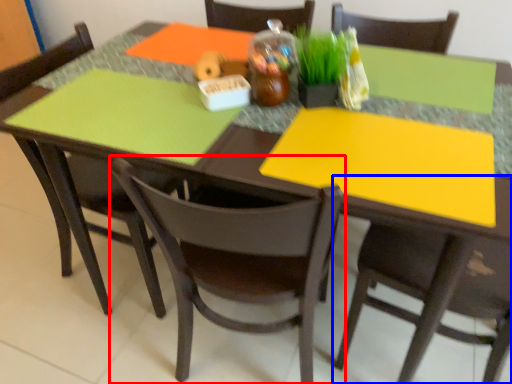
Question: Which object is further to the camera taking this photo, chair (highlighted by a red box) or chair (highlighted by a blue box)?

Choices:
 (A) chair
 (B) chair

Answer: (A)